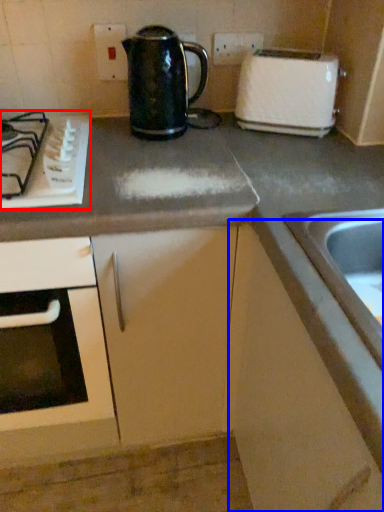
Question: Which point is further to the camera, gas stove (highlighted by a red box) or cabinetry (highlighted by a blue box)?

Choices:
 (A) gas stove
 (B) cabinetry

Answer: (A)